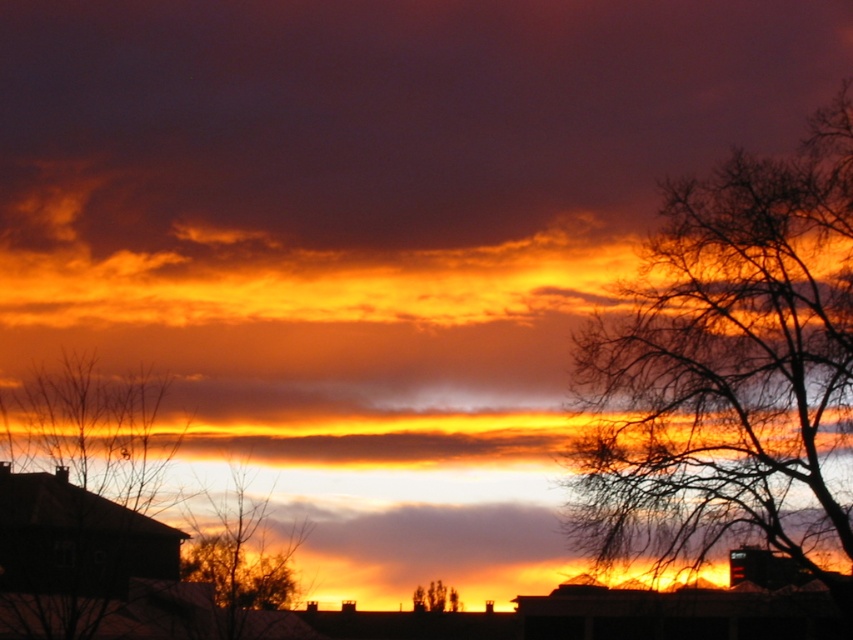
Can you confirm if silhouette bare tree at left is positioned below silhouette bare tree at center?

Incorrect, silhouette bare tree at left is not positioned below silhouette bare tree at center.

Who is more distant from viewer, (173, 528) or (239, 568)?

Point (239, 568)

Which is behind, point (9, 625) or point (213, 612)?

Positioned behind is point (213, 612).

At what (x,y) coordinates should I click in order to perform the action: click on silhouette bare tree at left. Please return your answer as a coordinate pair (x, y). The height and width of the screenshot is (640, 853). Looking at the image, I should click on (80, 497).

Which is more to the right, silhouette bare tree at left or silhouette leafless tree at center?

Positioned to the right is silhouette leafless tree at center.

Is silhouette bare tree at left to the right of silhouette leafless tree at center from the viewer's perspective?

Incorrect, silhouette bare tree at left is not on the right side of silhouette leafless tree at center.

You are a GUI agent. You are given a task and a screenshot of the screen. Output one action in this format:
    pyautogui.click(x=<x>, y=<y>)
    Task: Click on the silhouette bare tree at left
    The image size is (853, 640).
    Given the screenshot: What is the action you would take?
    pyautogui.click(x=80, y=497)

Does silhouette bare tree at center have a lesser width compared to silhouette leafless tree at center?

In fact, silhouette bare tree at center might be wider than silhouette leafless tree at center.

Can you confirm if silhouette bare tree at center is wider than silhouette leafless tree at center?

Yes, silhouette bare tree at center is wider than silhouette leafless tree at center.

Which is in front, point (247, 560) or point (436, 582)?

Point (247, 560) is more forward.

Locate an element on the screen. This screenshot has height=640, width=853. silhouette bare tree at center is located at coordinates (241, 561).